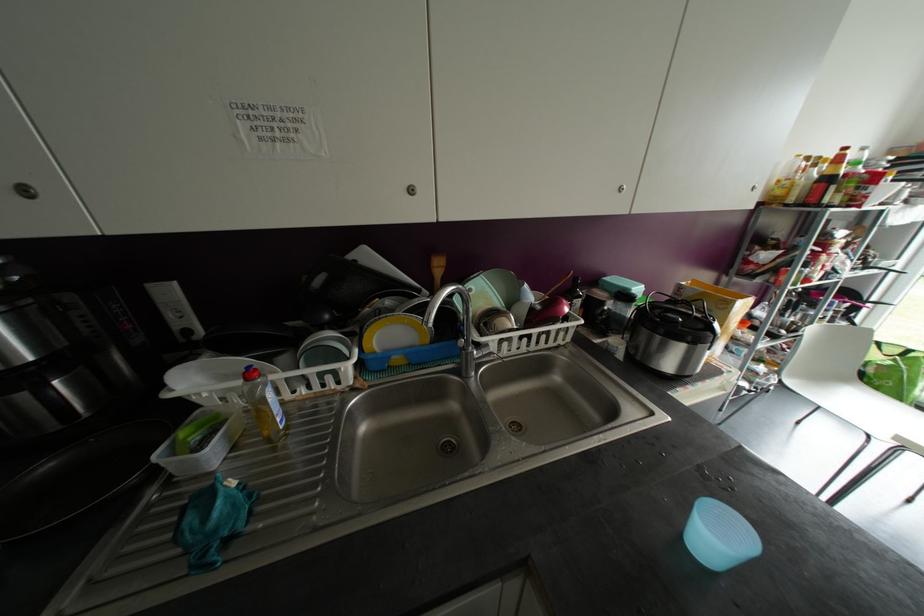
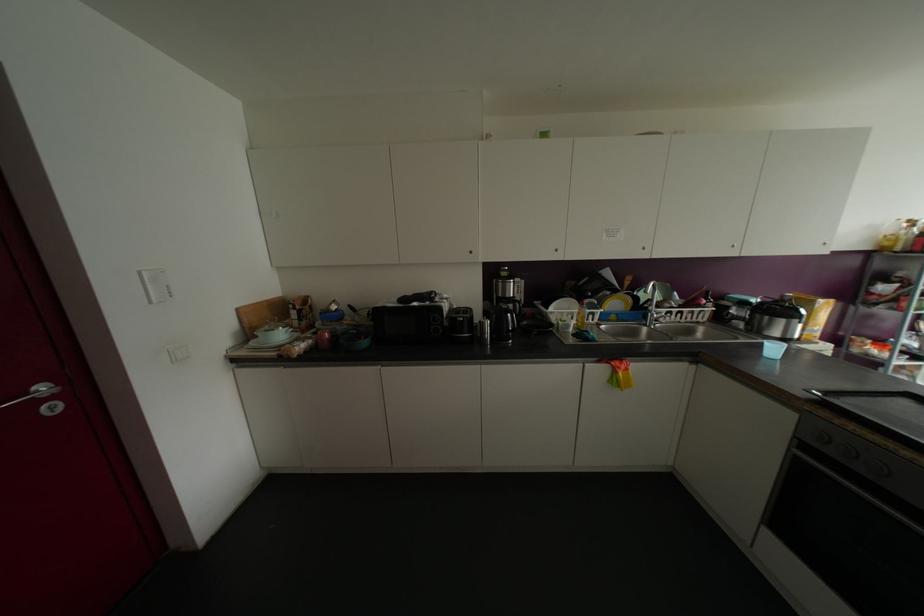
Where in the second image is the point corresponding to point (410, 190) from the first image?

(642, 248)